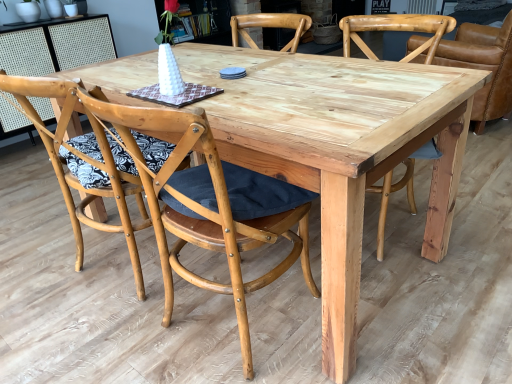
Where is `free space to the left of natural wood chair at center, acting as the third chair starting from the right`? This screenshot has width=512, height=384. free space to the left of natural wood chair at center, acting as the third chair starting from the right is located at coordinates (95, 341).